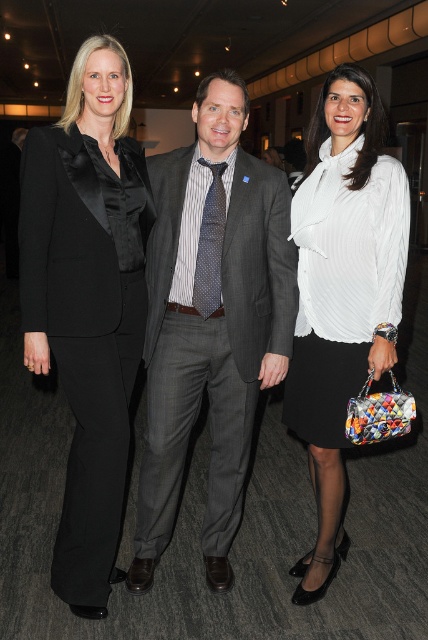
Question: Which object is positioned closest to the polka dot silk tie at center?

Choices:
 (A) black satin blazer at left
 (B) white pleated blouse at center

Answer: (A)

Question: Which object is the closest to the black satin blazer at left?

Choices:
 (A) gray pinstripe suit at center
 (B) white pleated blouse at center

Answer: (A)

Question: Is white pleated blouse at center above polka dot silk tie at center?

Choices:
 (A) yes
 (B) no

Answer: (B)

Question: Is gray pinstripe suit at center further to the viewer compared to black satin blazer at left?

Choices:
 (A) no
 (B) yes

Answer: (B)

Question: Does white pleated blouse at center have a smaller size compared to polka dot silk tie at center?

Choices:
 (A) no
 (B) yes

Answer: (A)

Question: Which object is farther from the camera taking this photo?

Choices:
 (A) white pleated blouse at center
 (B) polka dot silk tie at center

Answer: (B)